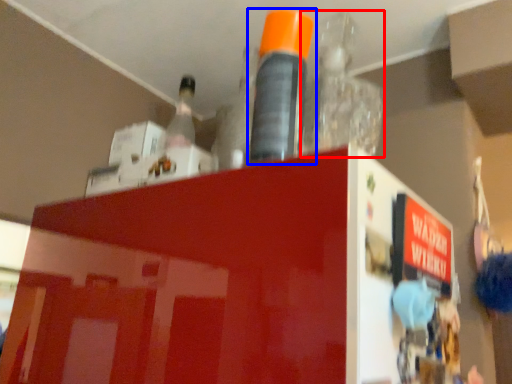
Question: Which point is further to the camera, bottle (highlighted by a red box) or bottle (highlighted by a blue box)?

Choices:
 (A) bottle
 (B) bottle

Answer: (A)